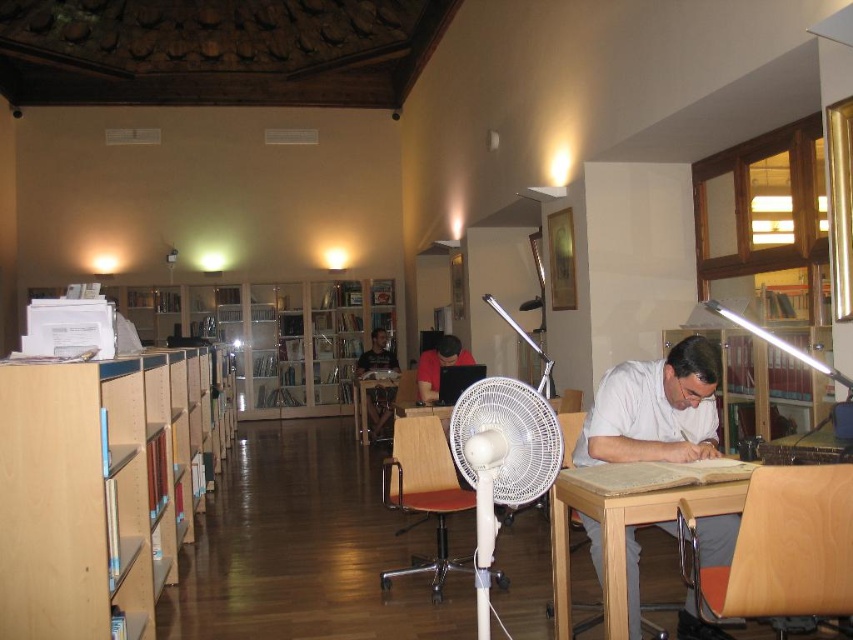
Question: Which point is farther to the camera?

Choices:
 (A) (296, 372)
 (B) (114, 627)
 (C) (529, 445)
 (D) (560, 554)

Answer: (A)

Question: Can you confirm if white plastic fan at center is bigger than dark blue shirt at center?

Choices:
 (A) yes
 (B) no

Answer: (B)

Question: Which point is farther to the camera?

Choices:
 (A) (364, 360)
 (B) (421, 392)
 (C) (97, 532)
 (D) (728, 458)

Answer: (A)

Question: Does wooden table at lower right appear under red matte shirt at center?

Choices:
 (A) yes
 (B) no

Answer: (A)

Question: Which point appears farthest from the camera in this image?

Choices:
 (A) (375, 340)
 (B) (424, 349)

Answer: (A)

Question: Is wooden bookcase at center bigger than red matte shirt at center?

Choices:
 (A) no
 (B) yes

Answer: (B)